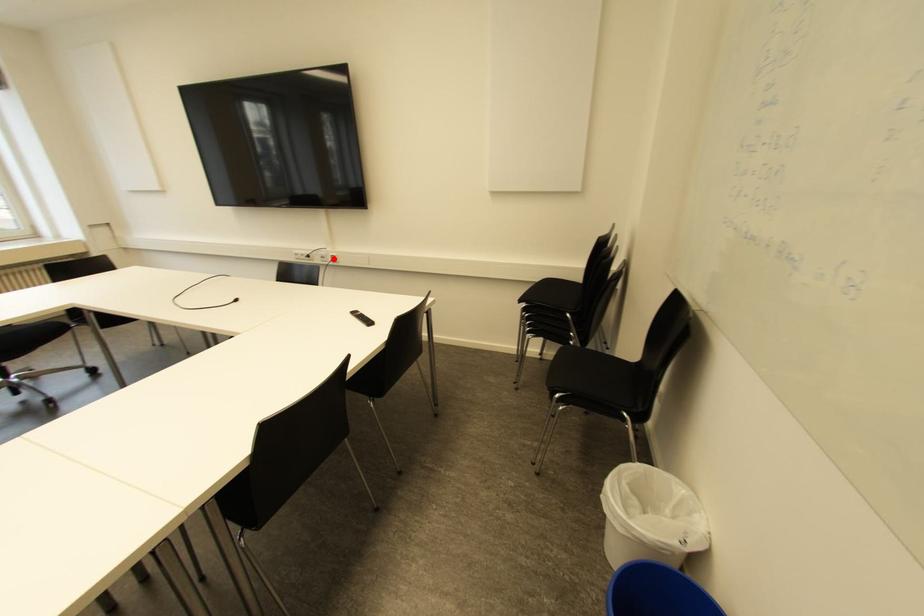
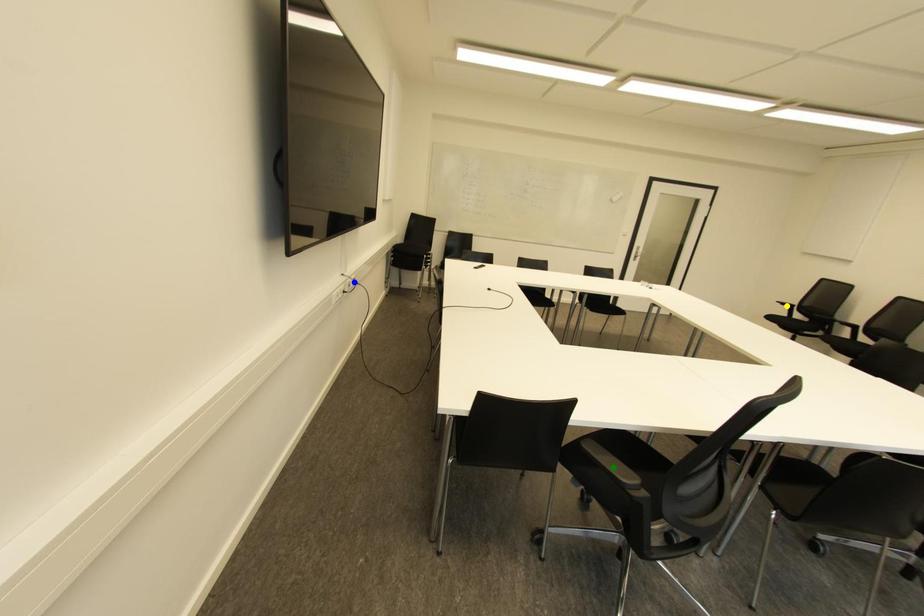
Question: I am providing you with two images of the same scene from different viewpoints. A red point is marked on the first image. You are given multiple points on the second image. Which point in image 2 represents the same 3d spot as the red point in image 1?

Choices:
 (A) blue point
 (B) yellow point
 (C) green point

Answer: (A)